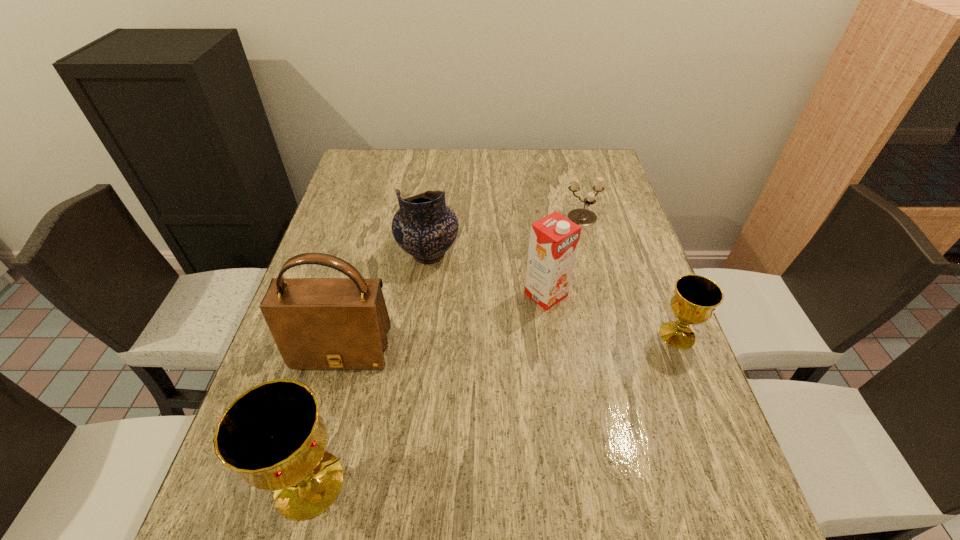
Locate an element on the screen. This screenshot has width=960, height=540. spot to insert another chalice for uniform distribution is located at coordinates (517, 400).